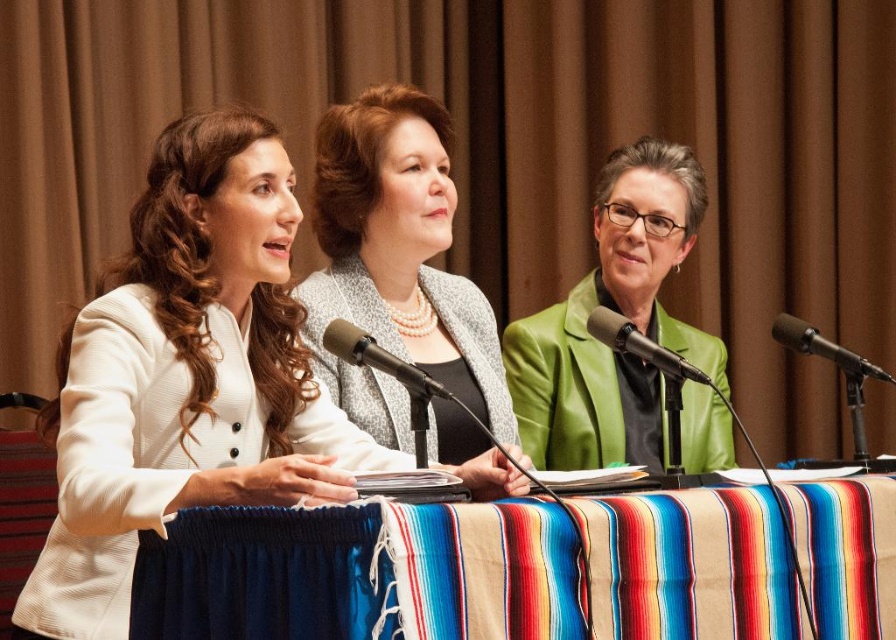
Does white textured blazer at left have a smaller size compared to metallic green microphone at center?

No.

Measure the distance between point (82, 582) and camera.

1.71 meters

Does point (168, 508) lie behind point (629, 339)?

No, it is not.

In order to click on white textured blazer at left in this screenshot , I will do `click(187, 378)`.

Does point (517, 381) lie in front of point (843, 369)?

No, it is not.

Consider the image. Who is more forward, (x=565, y=452) or (x=806, y=342)?

Point (x=806, y=342) is more forward.

This screenshot has height=640, width=896. Find the location of `green leather jacket at center`. green leather jacket at center is located at coordinates (619, 312).

Is green leather jacket at center thinner than metallic green microphone at center?

No.

Is point (584, 410) farther from viewer compared to point (630, 339)?

Yes, point (584, 410) is farther from viewer.

Locate an element on the screen. Image resolution: width=896 pixels, height=640 pixels. green leather jacket at center is located at coordinates (619, 312).